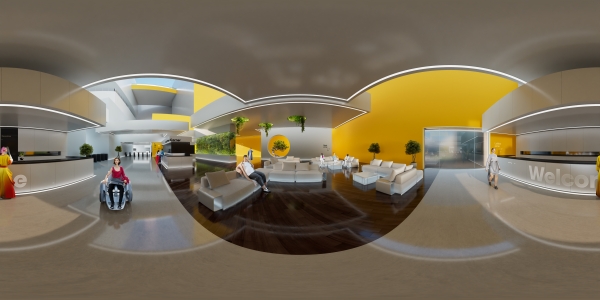
Locate an element on the screen. The image size is (600, 300). floor is located at coordinates (316, 244).